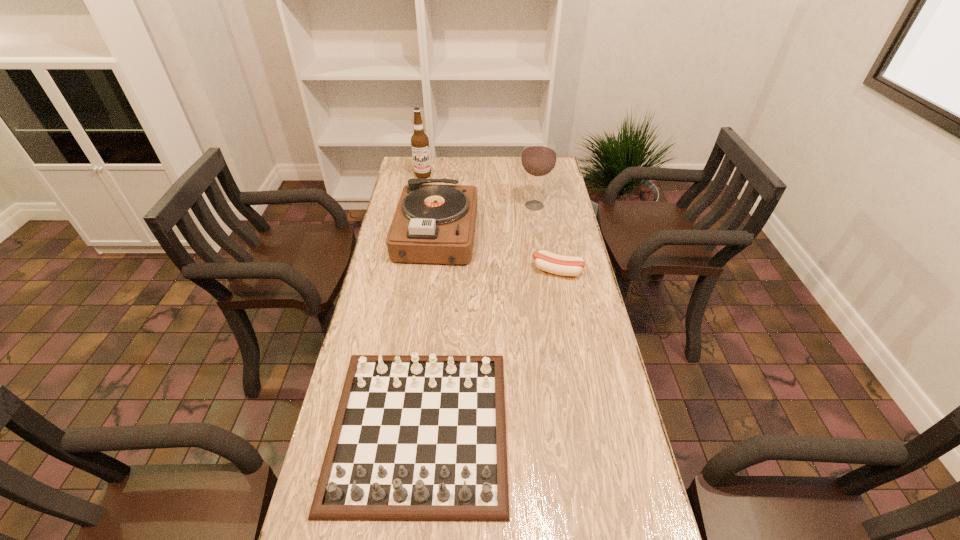
You are a GUI agent. You are given a task and a screenshot of the screen. Output one action in this format:
    pyautogui.click(x=<x>, y=<y>)
    Task: Click on the vacant space located 0.290m on the back of the second shortest object
    The height and width of the screenshot is (540, 960).
    Given the screenshot: What is the action you would take?
    pyautogui.click(x=435, y=287)

At what (x,y) coordinates should I click in order to perform the action: click on vacant area located on the back of the sausage. Please return your answer as a coordinate pair (x, y). Looking at the image, I should click on pyautogui.click(x=548, y=226).

Locate an element on the screen. This screenshot has width=960, height=540. object located at the far edge is located at coordinates (419, 141).

Where is `alcohol that is at the left edge`? The height and width of the screenshot is (540, 960). alcohol that is at the left edge is located at coordinates (419, 141).

Identify the location of record player that is at the left edge. (432, 223).

At what (x,y) coordinates should I click in order to perform the action: click on chessboard located in the left edge section of the desktop. Please return your answer as a coordinate pair (x, y). Looking at the image, I should click on pos(416,437).

Image resolution: width=960 pixels, height=540 pixels. In order to click on alcohol located at the right edge in this screenshot , I will do `click(538, 159)`.

Where is `sausage located in the right edge section of the desktop`? The height and width of the screenshot is (540, 960). sausage located in the right edge section of the desktop is located at coordinates [556, 264].

You are a GUI agent. You are given a task and a screenshot of the screen. Output one action in this format:
    pyautogui.click(x=<x>, y=<y>)
    Task: Click on the object present at the far left corner
    
    Given the screenshot: What is the action you would take?
    [x=419, y=141]

The image size is (960, 540). What are the coordinates of `free space at the far edge of the desktop` in the screenshot? It's located at (x=462, y=172).